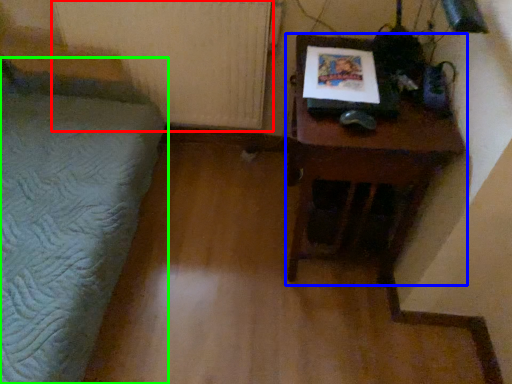
Question: Which object is the closest to the radiator (highlighted by a red box)? Choose among these: table (highlighted by a blue box) or furniture (highlighted by a green box).

Choices:
 (A) table
 (B) furniture

Answer: (B)